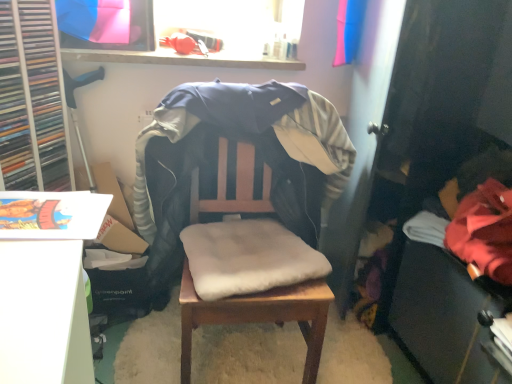
What are the coordinates of `free region under wooden chair with cushion at center (from a real-world perspective)` in the screenshot? It's located at coord(247,362).